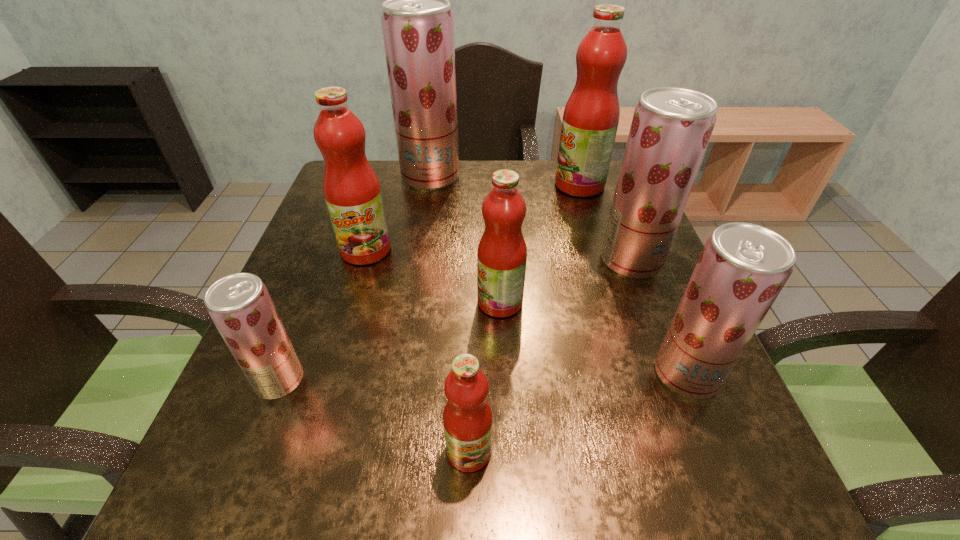
The width and height of the screenshot is (960, 540). I want to click on the smallest strawberry fruit juice, so click(x=240, y=306).

What are the coordinates of `the nearest pink fruit juice` in the screenshot? It's located at (467, 417).

Find the location of a particular element. This screenshot has height=540, width=960. the smallest pink fruit juice is located at coordinates click(x=467, y=417).

In order to click on vacant space located on the right of the farthest strawberry fruit juice in this screenshot , I will do `click(531, 177)`.

At what (x,y) coordinates should I click in order to perform the action: click on blank area located on the front label of the rightmost pink fruit juice. Please return your answer as a coordinate pair (x, y). The height and width of the screenshot is (540, 960). Looking at the image, I should click on (519, 185).

Where is `free space located 0.350m on the front label of the rightmost pink fruit juice`? free space located 0.350m on the front label of the rightmost pink fruit juice is located at coordinates tap(433, 185).

Where is `blank space located on the front label of the rightmost pink fruit juice`? This screenshot has height=540, width=960. blank space located on the front label of the rightmost pink fruit juice is located at coordinates (468, 185).

Find the location of a particular element. This screenshot has height=540, width=960. vacant space located on the front label of the leftmost pink fruit juice is located at coordinates (345, 322).

Find the location of a particular element. vacant space positioned on the left of the second biggest strawberry fruit juice is located at coordinates (429, 260).

The height and width of the screenshot is (540, 960). In order to click on vacant space located on the front label of the fourth nearest fruit juice in this screenshot , I will do `click(301, 302)`.